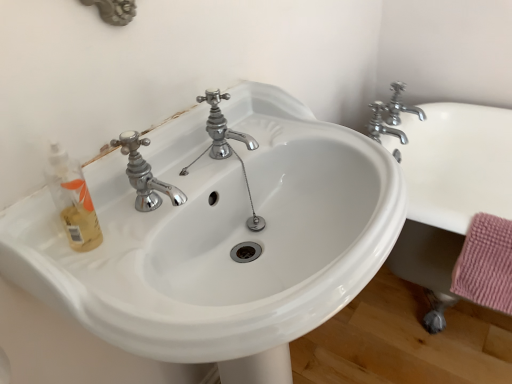
Question: Is chrome metallic faucet at upper right, acting as the 2th tap starting from the left, touching white glossy sink at center?

Choices:
 (A) no
 (B) yes

Answer: (A)

Question: Could you tell me if chrome metallic faucet at upper right, acting as the 2th tap starting from the left, is facing white glossy sink at center?

Choices:
 (A) yes
 (B) no

Answer: (B)

Question: Considering the relative sizes of chrome metallic faucet at upper right, acting as the first tap starting from the right, and white glossy sink at center in the image provided, is chrome metallic faucet at upper right, acting as the first tap starting from the right, thinner than white glossy sink at center?

Choices:
 (A) no
 (B) yes

Answer: (B)

Question: Is chrome metallic faucet at upper right, acting as the 2th tap starting from the left, behind white glossy sink at center?

Choices:
 (A) no
 (B) yes

Answer: (B)

Question: From a real-world perspective, is chrome metallic faucet at upper right, acting as the first tap starting from the right, physically below white glossy sink at center?

Choices:
 (A) yes
 (B) no

Answer: (B)

Question: Relative to chrome metallic faucet at upper right, the 1th tap viewed from the left, is white ceramic bath at right in front or behind?

Choices:
 (A) front
 (B) behind

Answer: (A)

Question: Is white ceramic bath at right wider or thinner than chrome metallic faucet at upper right, the 1th tap viewed from the left?

Choices:
 (A) thin
 (B) wide

Answer: (B)

Question: From a real-world perspective, is white ceramic bath at right above or below chrome metallic faucet at upper right, the second tap from the right?

Choices:
 (A) above
 (B) below

Answer: (B)

Question: Would you say white ceramic bath at right is inside or outside chrome metallic faucet at upper right, the 1th tap viewed from the left?

Choices:
 (A) outside
 (B) inside

Answer: (A)

Question: Looking at their shapes, would you say chrome metallic faucet at upper right, acting as the first tap starting from the right, is wider or thinner than white glossy sink at center?

Choices:
 (A) wide
 (B) thin

Answer: (B)

Question: Considering the relative positions of chrome metallic faucet at upper right, acting as the 2th tap starting from the left, and white glossy sink at center in the image provided, is chrome metallic faucet at upper right, acting as the 2th tap starting from the left, to the left or to the right of white glossy sink at center?

Choices:
 (A) left
 (B) right

Answer: (B)

Question: Based on their sizes in the image, would you say chrome metallic faucet at upper right, acting as the first tap starting from the right, is bigger or smaller than white glossy sink at center?

Choices:
 (A) big
 (B) small

Answer: (B)

Question: Choose the correct answer: Is chrome metallic faucet at upper right, acting as the first tap starting from the right, inside white glossy sink at center or outside it?

Choices:
 (A) outside
 (B) inside

Answer: (A)

Question: Considering the positions of chrome metallic faucet at upper right, the second tap from the right, and chrome metallic faucet at upper right, acting as the first tap starting from the right, in the image, is chrome metallic faucet at upper right, the second tap from the right, wider or thinner than chrome metallic faucet at upper right, acting as the first tap starting from the right,?

Choices:
 (A) wide
 (B) thin

Answer: (A)

Question: In the image, is chrome metallic faucet at upper right, the 1th tap viewed from the left, on the left side or the right side of chrome metallic faucet at upper right, acting as the first tap starting from the right?

Choices:
 (A) right
 (B) left

Answer: (B)